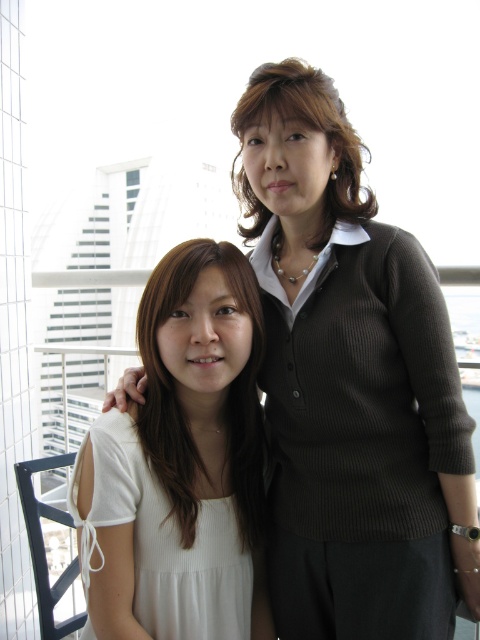
In the scene shown: You are a photographer adjusting your camera settings. You want to focus on the white matte shirt at center. What are the coordinates to set in your camera to ensure precise focus?

The coordinates to set in your camera for precise focus on the white matte shirt at center are at point (180, 406).

You are a photographer trying to position two markers on a grid overlay for a photo editing software. The markers are placed at point (342,456) and point (187,636). Based on the scene, which marker is closer to the camera?

Point (342,456) is closer to the viewer than point (187,636).

You are a photographer trying to capture a candid shot of both the white ribbed dress at left and the matte brown hair at center. Given that your camera has a depth of field that can focus on objects within a 4 feet range, will both subjects be in focus?

The white ribbed dress at left and the matte brown hair at center are 3.95 feet apart. Since the distance between them is within the camera lens depth of field range of 4 feet, both subjects will be in focus.